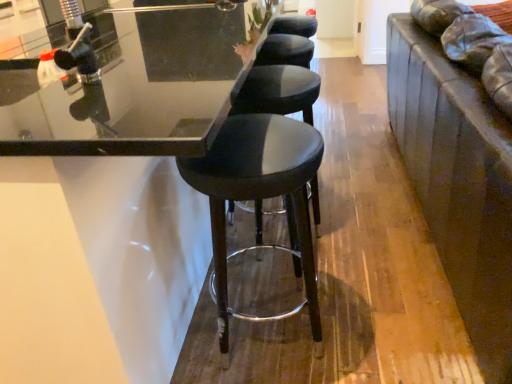
What are the coordinates of `free region under black leather stool at center, which is the first stool from front to back (from a real-world perspective)` in the screenshot? It's located at (290, 334).